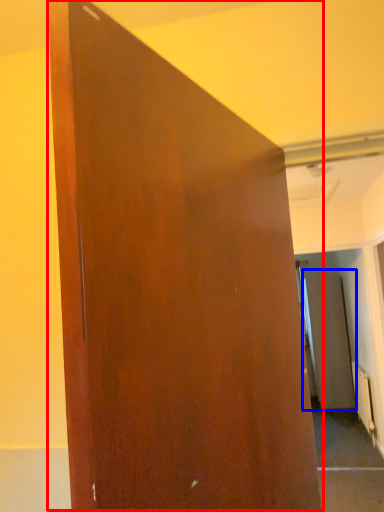
Question: Which object appears farthest to the camera in this image, door (highlighted by a red box) or screen door (highlighted by a blue box)?

Choices:
 (A) door
 (B) screen door

Answer: (B)